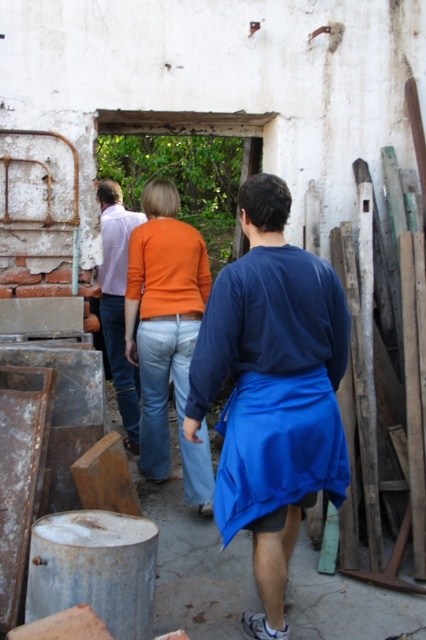
Can you confirm if orange cotton shirt at center is positioned to the left of matte purple shirt at center?

No, orange cotton shirt at center is not to the left of matte purple shirt at center.

This screenshot has width=426, height=640. What do you see at coordinates (166, 333) in the screenshot?
I see `orange cotton shirt at center` at bounding box center [166, 333].

The width and height of the screenshot is (426, 640). In order to click on orange cotton shirt at center in this screenshot , I will do `click(166, 333)`.

Which is above, blue fabric apron at center or matte purple shirt at center?

matte purple shirt at center

Who is taller, blue fabric apron at center or matte purple shirt at center?

Standing taller between the two is matte purple shirt at center.

The image size is (426, 640). What are the coordinates of `blue fabric apron at center` in the screenshot? It's located at (273, 388).

Which of these two, blue fabric apron at center or orange cotton shirt at center, stands taller?

orange cotton shirt at center is taller.

Can you confirm if blue fabric apron at center is positioned above orange cotton shirt at center?

Incorrect, blue fabric apron at center is not positioned above orange cotton shirt at center.

Is point (193, 369) closer to camera compared to point (134, 296)?

Yes, it is in front of point (134, 296).

Find the location of `blue fabric apron at center`. blue fabric apron at center is located at coordinates coord(273,388).